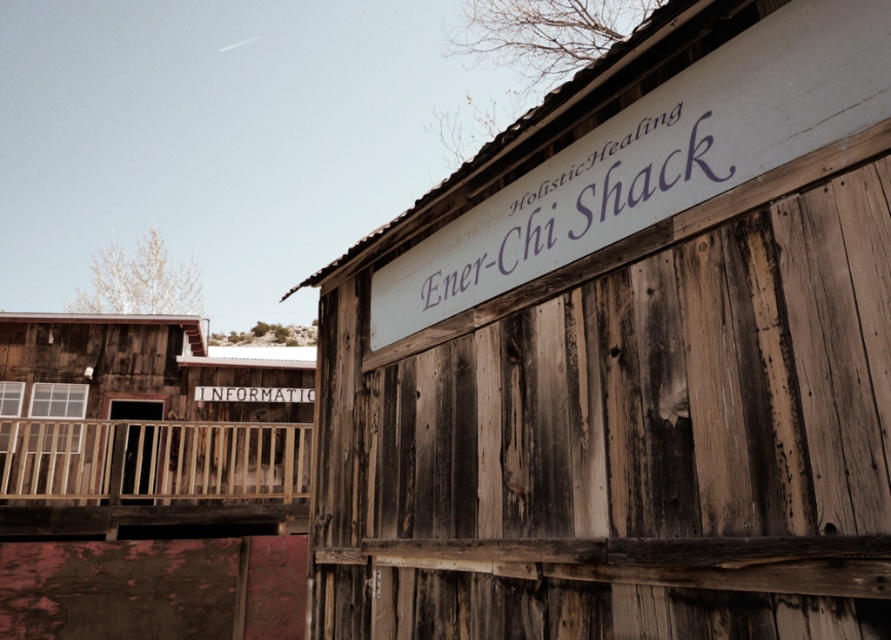
You are standing in front of the Holistic Healing Ener Chi Shack and need to place a 3 meter long ladder between the weathered wood information sign at left and the wooden at left. Will the ladder fit between them?

The distance between the weathered wood information sign at left and the wooden at left is 2.51 meters. Since the ladder is 3 meters long, it will not fit between them as the space is shorter than the ladder.

You are standing in front of the Holistic Healing Ener Chi Shack. You need to locate the purple painted wood sign at upper center. Where exactly is it located in terms of coordinates?

The purple painted wood sign at upper center is located at coordinates point (577, 202).

You are standing in front of the Holistic Healing Ener Chi Shack and see the weathered wood information sign at left and the wooden at left. Which one is positioned more to the left side?

The weathered wood information sign at left is more to the left than the wooden at left.